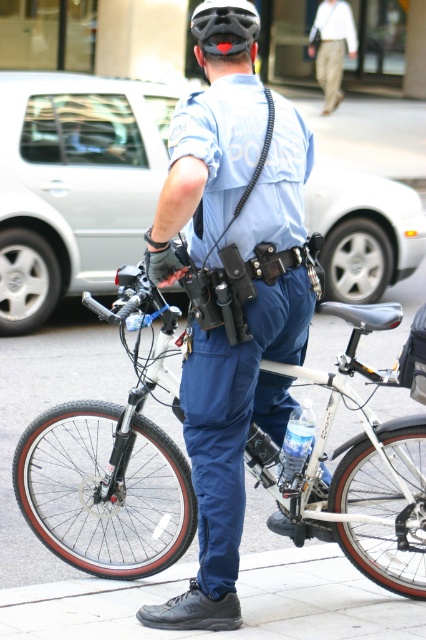
Question: Can you confirm if blue uniform at center is smaller than black matte helmet at center?

Choices:
 (A) yes
 (B) no

Answer: (B)

Question: Which point is closer to the camera?

Choices:
 (A) (313, 24)
 (B) (397, 468)
 (C) (227, 10)
 (D) (250, 113)

Answer: (C)

Question: Which object is the closest to the black matte helmet at center?

Choices:
 (A) khaki cotton pants at upper center
 (B) silver metallic bicycle at center
 (C) blue uniform at center

Answer: (C)

Question: Which of the following is the farthest from the observer?

Choices:
 (A) blue uniform at center
 (B) khaki cotton pants at upper center
 (C) silver metallic bicycle at center

Answer: (B)

Question: Can you confirm if silver metallic bicycle at center is smaller than khaki cotton pants at upper center?

Choices:
 (A) no
 (B) yes

Answer: (A)

Question: Can you confirm if khaki cotton pants at upper center is positioned above black matte helmet at center?

Choices:
 (A) yes
 (B) no

Answer: (A)